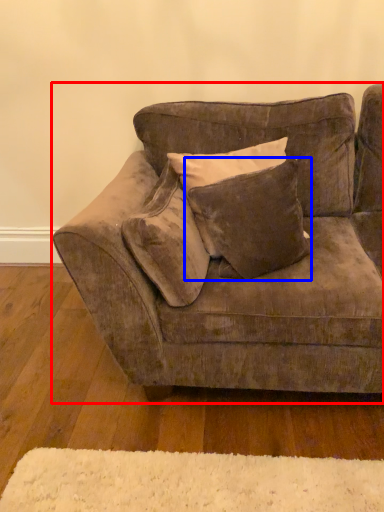
Question: Which of the following is the farthest to the observer, studio couch (highlighted by a red box) or pillow (highlighted by a blue box)?

Choices:
 (A) studio couch
 (B) pillow

Answer: (B)